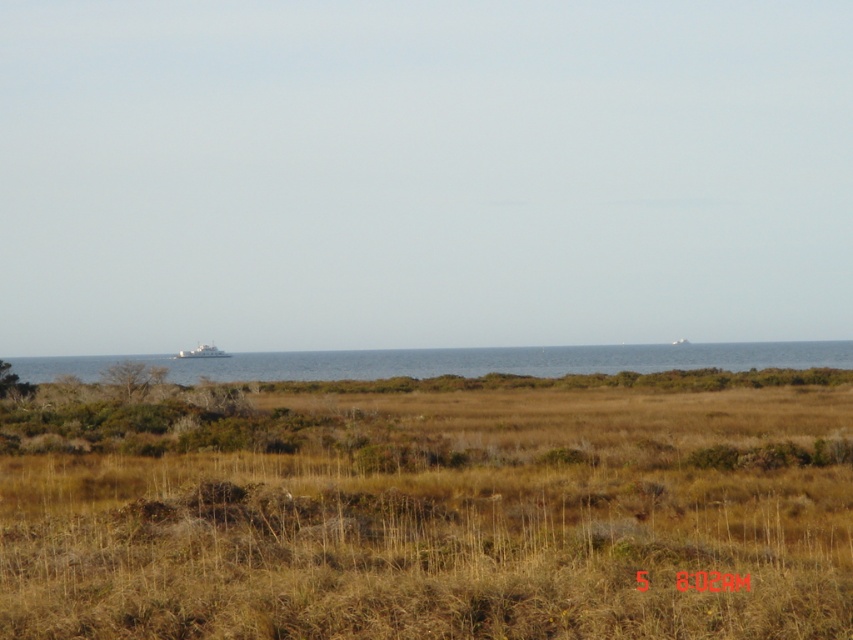
Consider the image. Measure the distance between brown dry grass at center and blue water at center.

They are 171.33 feet apart.

Between brown dry grass at center and blue water at center, which one is positioned lower?

blue water at center

Does point (822, 504) come in front of point (21, 364)?

Yes, point (822, 504) is in front of point (21, 364).

In order to click on brown dry grass at center in this screenshot , I will do `click(450, 518)`.

How much distance is there between blue water at center and white matte boat at center?

They are 27.52 meters apart.

Who is shorter, blue water at center or white matte boat at center?

Standing shorter between the two is white matte boat at center.

Locate an element on the screen. blue water at center is located at coordinates (456, 362).

Is the position of brown dry grass at center more distant than that of white matte boat at center?

No, it is in front of white matte boat at center.

Based on the photo, how far apart are brown dry grass at center and white matte boat at center?

brown dry grass at center is 367.42 feet away from white matte boat at center.

Which is behind, point (807, 568) or point (194, 355)?

Point (194, 355)

Where is `brown dry grass at center`? This screenshot has width=853, height=640. brown dry grass at center is located at coordinates [x=450, y=518].